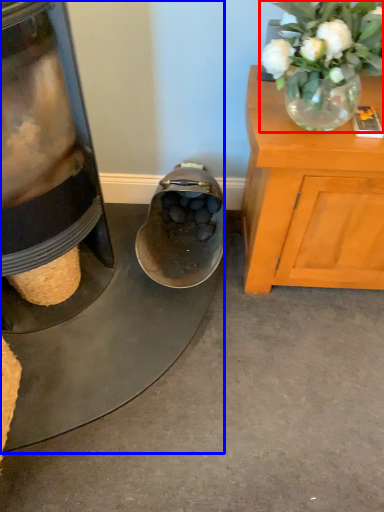
Question: Which of the following is the farthest to the observer, floral arrangement (highlighted by a red box) or appliance (highlighted by a blue box)?

Choices:
 (A) floral arrangement
 (B) appliance

Answer: (B)